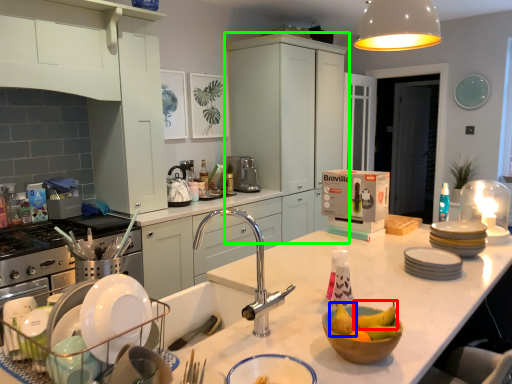
Question: Estimate the real-world distances between objects in this image. Which object is closer to fruit (highlighted by a red box), fruit (highlighted by a blue box) or cabinetry (highlighted by a green box)?

Choices:
 (A) fruit
 (B) cabinetry

Answer: (A)